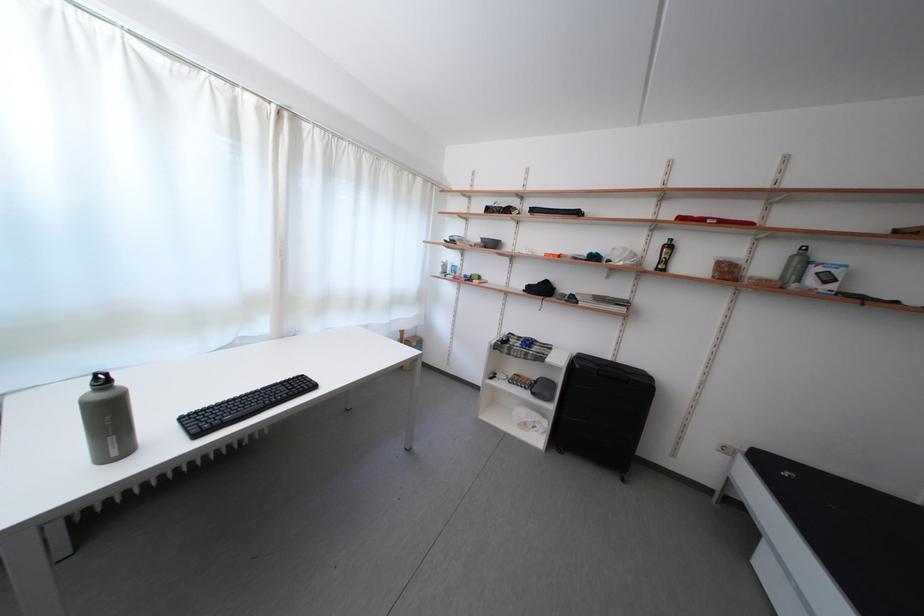
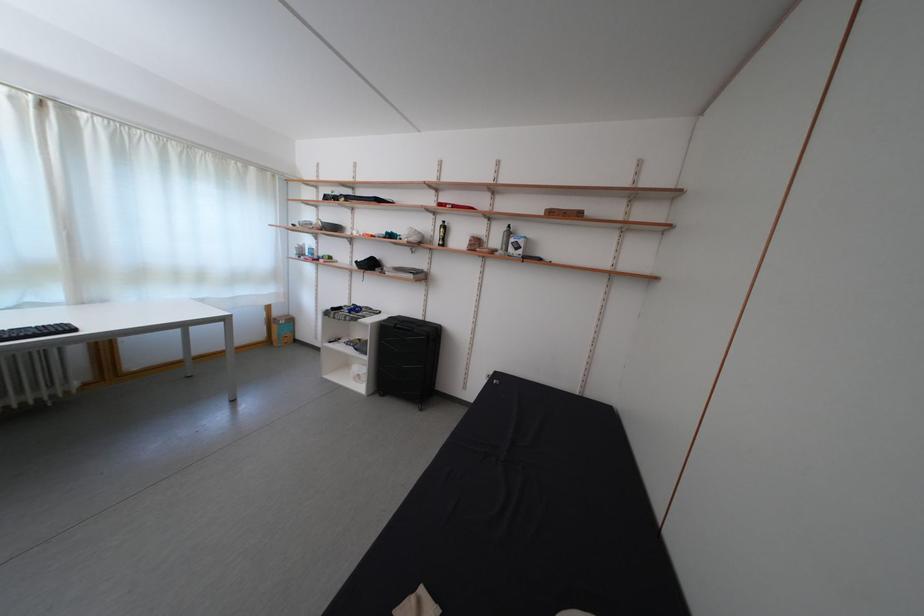
Locate, in the second image, the point that corresponds to the point at 416,341 in the first image.

(285, 320)